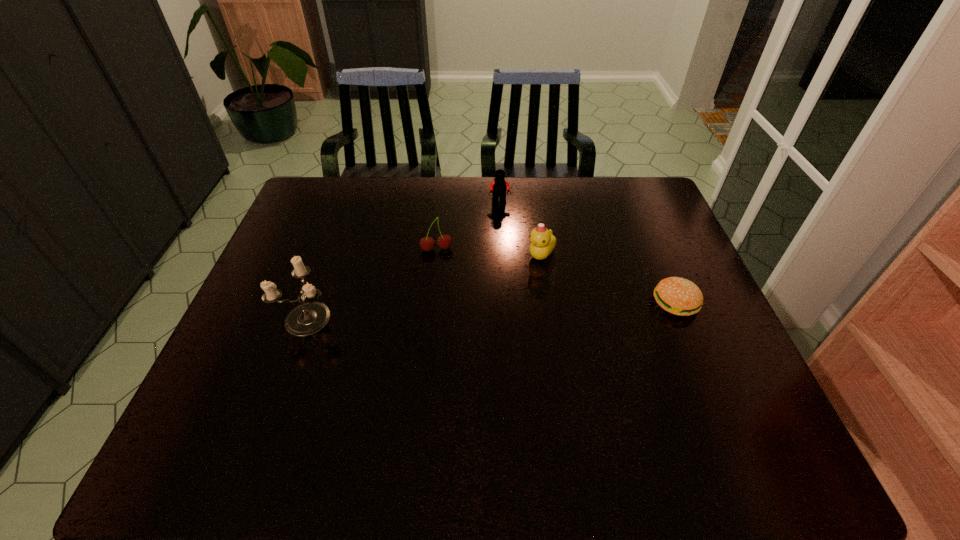
This screenshot has width=960, height=540. In order to click on free spot on the desktop that is between the leftmost object and the rightmost object and is positioned on the front-facing side of the Lego in this screenshot , I will do `click(502, 309)`.

Find the location of a particular element. This screenshot has height=540, width=960. vacant spot on the desktop that is between the leftmost object and the shortest object and is positioned on the surface of the cherry is located at coordinates (442, 311).

I want to click on free space on the desktop that is between the tallest object and the rightmost object and is positioned on the front-facing side of the duckling, so click(526, 308).